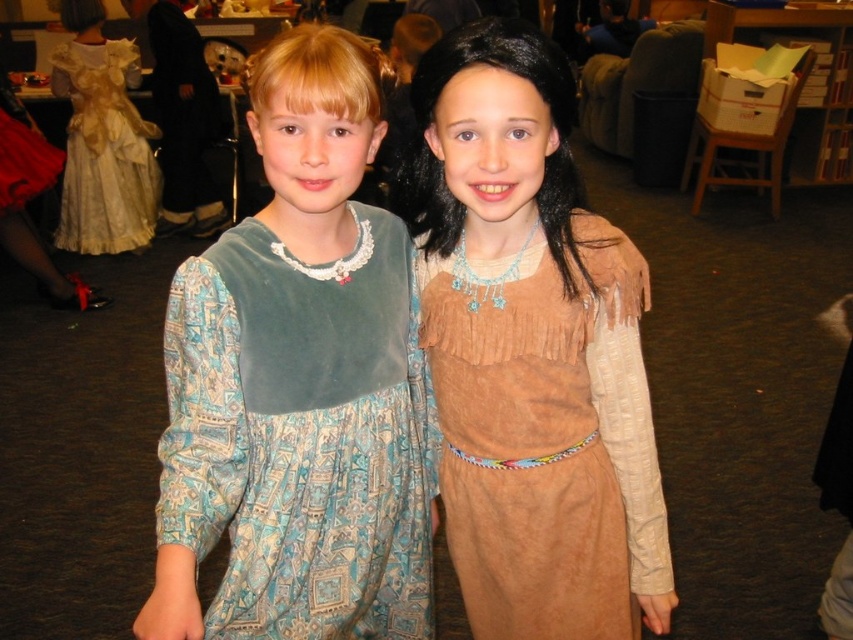
Question: Can you confirm if velvet dress at left is positioned to the left of gold lace dress at upper left?

Choices:
 (A) no
 (B) yes

Answer: (A)

Question: Is suede-like brown dress at center closer to camera compared to gold lace dress at upper left?

Choices:
 (A) no
 (B) yes

Answer: (B)

Question: Which is farther from the gold lace dress at upper left?

Choices:
 (A) velvet dress at left
 (B) suede-like brown dress at center

Answer: (B)

Question: Which of the following is the closest to the observer?

Choices:
 (A) velvet dress at left
 (B) suede-like brown dress at center
 (C) gold lace dress at upper left

Answer: (A)

Question: Which object is closer to the camera taking this photo?

Choices:
 (A) velvet dress at left
 (B) gold lace dress at upper left

Answer: (A)

Question: Can you confirm if velvet dress at left is thinner than gold lace dress at upper left?

Choices:
 (A) yes
 (B) no

Answer: (A)